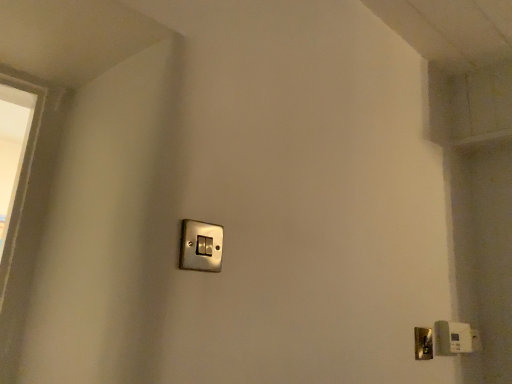
Question: From the image's perspective, is satin silver light switch at lower right, arranged as the second light switch when viewed from the top, located beneath metallic silver light switch at center, acting as the first light switch starting from the front?

Choices:
 (A) no
 (B) yes

Answer: (B)

Question: Does satin silver light switch at lower right, arranged as the second light switch when viewed from the top, have a larger size compared to metallic silver light switch at center, acting as the first light switch starting from the front?

Choices:
 (A) no
 (B) yes

Answer: (B)

Question: Is satin silver light switch at lower right, the first light switch when ordered from bottom to top, at the left side of metallic silver light switch at center, acting as the first light switch starting from the front?

Choices:
 (A) yes
 (B) no

Answer: (B)

Question: Does satin silver light switch at lower right, arranged as the second light switch when viewed from the top, have a greater width compared to metallic silver light switch at center, acting as the first light switch starting from the front?

Choices:
 (A) no
 (B) yes

Answer: (B)

Question: Can you confirm if satin silver light switch at lower right, the first light switch when ordered from bottom to top, is positioned to the right of metallic silver light switch at center, the first light switch viewed from the left?

Choices:
 (A) no
 (B) yes

Answer: (B)

Question: Relative to satin silver light switch at lower right, the 2th light switch positioned from the left, is polished brass door handle at lower right in front or behind?

Choices:
 (A) front
 (B) behind

Answer: (A)

Question: Is polished brass door handle at lower right to the left or to the right of satin silver light switch at lower right, the second light switch from the front, in the image?

Choices:
 (A) right
 (B) left

Answer: (B)

Question: From a real-world perspective, is polished brass door handle at lower right physically located above or below satin silver light switch at lower right, the first light switch when ordered from bottom to top?

Choices:
 (A) below
 (B) above

Answer: (A)

Question: Is point (418, 337) positioned closer to the camera than point (458, 331)?

Choices:
 (A) farther
 (B) closer

Answer: (B)

Question: From the image's perspective, relative to polished brass door handle at lower right, is metallic silver light switch at center, the second light switch positioned from the bottom, above or below?

Choices:
 (A) below
 (B) above

Answer: (B)

Question: From their relative heights in the image, would you say metallic silver light switch at center, which appears as the second light switch when viewed from the right, is taller or shorter than polished brass door handle at lower right?

Choices:
 (A) short
 (B) tall

Answer: (A)

Question: Is point (216, 264) closer or farther from the camera than point (415, 329)?

Choices:
 (A) closer
 (B) farther

Answer: (A)

Question: Considering the positions of metallic silver light switch at center, the first light switch viewed from the left, and polished brass door handle at lower right in the image, is metallic silver light switch at center, the first light switch viewed from the left, wider or thinner than polished brass door handle at lower right?

Choices:
 (A) wide
 (B) thin

Answer: (A)

Question: From a real-world perspective, is satin silver light switch at lower right, arranged as the second light switch when viewed from the top, positioned above or below metallic silver light switch at center, the first light switch viewed from the left?

Choices:
 (A) above
 (B) below

Answer: (B)

Question: From their relative heights in the image, would you say satin silver light switch at lower right, the first light switch when ordered from bottom to top, is taller or shorter than metallic silver light switch at center, acting as the 1th light switch starting from the top?

Choices:
 (A) tall
 (B) short

Answer: (A)